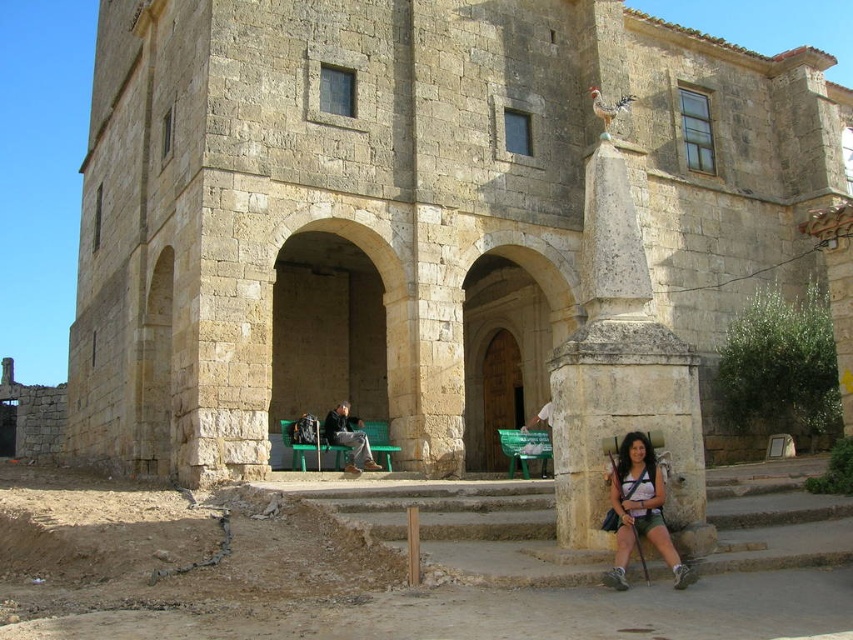
You are a photographer standing in front of the historic stone building. You want to take a picture that includes both the stone column at center and the matte white shirt at lower right. Which object should you focus on first if you want both to be in clear focus?

The stone column at center is much taller than the matte white shirt at lower right, so you should focus on the stone column at center first to ensure both are in clear focus.

You are a visitor standing in front of the historic stone building. You notice the stone column at center and the matte white shirt at lower right. Which object is closer to you?

The stone column at center is closer to you because the matte white shirt at lower right is behind it.